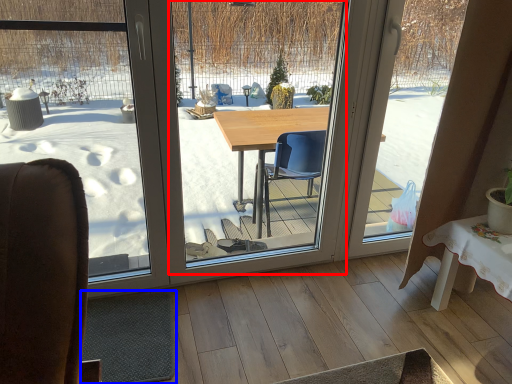
Question: Which of the following is the farthest to the observer, window screen (highlighted by a red box) or flat (highlighted by a blue box)?

Choices:
 (A) window screen
 (B) flat

Answer: (B)